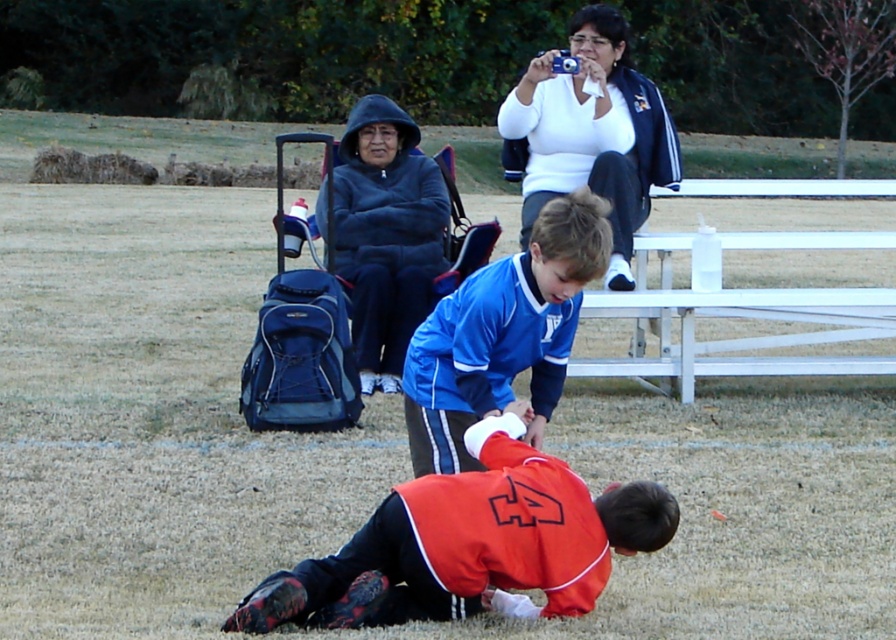
Question: Can you confirm if orange jersey at lower center is bigger than dark blue hoodie at upper center?

Choices:
 (A) no
 (B) yes

Answer: (A)

Question: Is the position of blue synthetic jersey at center more distant than that of white matte jacket at upper center?

Choices:
 (A) no
 (B) yes

Answer: (A)

Question: Considering the real-world distances, which object is closest to the orange jersey at lower center?

Choices:
 (A) blue synthetic jersey at center
 (B) dark blue hoodie at upper center

Answer: (A)

Question: Which point is closer to the camera?

Choices:
 (A) orange jersey at lower center
 (B) white matte jacket at upper center

Answer: (A)

Question: Which point is farther from the camera taking this photo?

Choices:
 (A) (582, 120)
 (B) (373, 536)

Answer: (A)

Question: Is blue synthetic jersey at center thinner than dark blue hoodie at upper center?

Choices:
 (A) no
 (B) yes

Answer: (B)